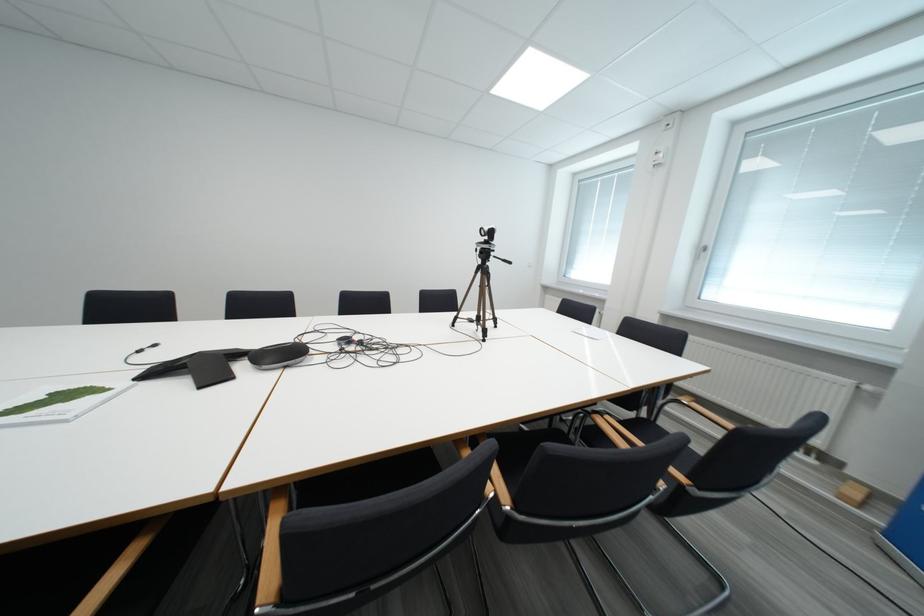
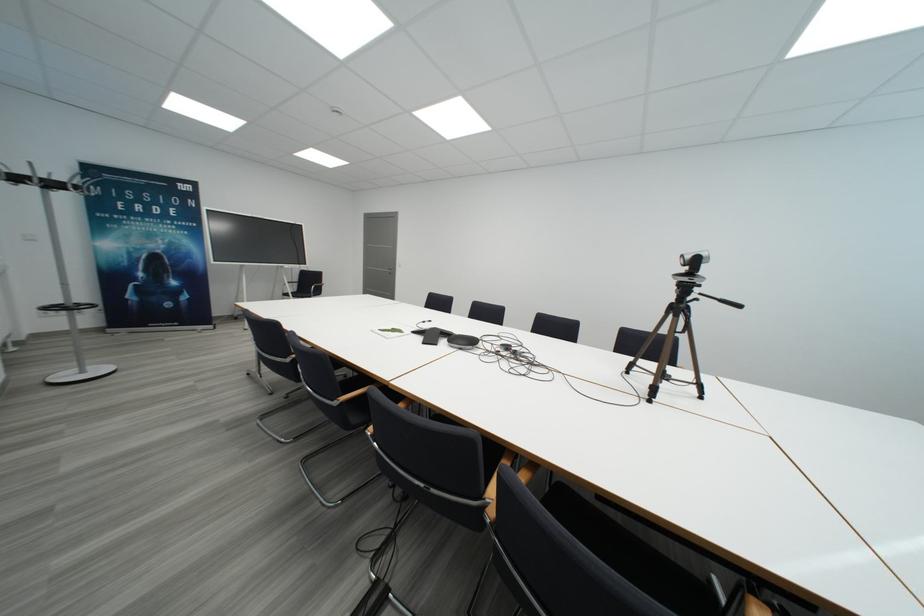
The point at (497, 236) is marked in the first image. Where is the corresponding point in the second image?

(702, 265)